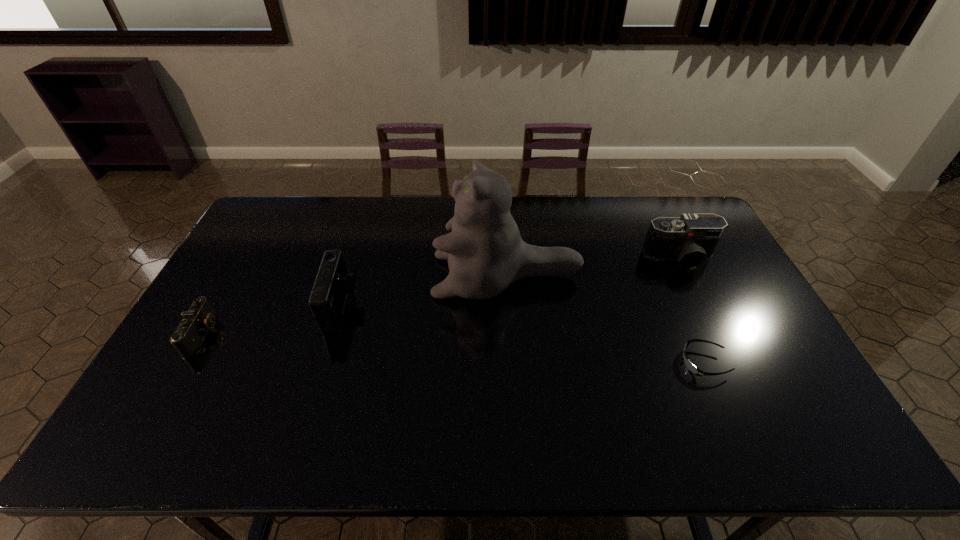
Image resolution: width=960 pixels, height=540 pixels. I want to click on vacant space located on the front-facing side of the fourth object from right to left, so click(472, 307).

The image size is (960, 540). Identify the location of vacant space located on the front-facing side of the rightmost camera. click(x=707, y=313).

Where is `vacant region located on the front-facing side of the leftmost camera`? This screenshot has width=960, height=540. vacant region located on the front-facing side of the leftmost camera is located at coordinates pyautogui.click(x=269, y=334).

Find the location of `free location located on the lenses of the sunglasses`. free location located on the lenses of the sunglasses is located at coordinates (553, 363).

I want to click on blank area located 0.230m on the lenses of the sunglasses, so click(594, 363).

At what (x,y) coordinates should I click in order to perform the action: click on vacant space situated 0.290m on the lenses of the sunglasses. Please return your answer as a coordinate pair (x, y). The width and height of the screenshot is (960, 540). Looking at the image, I should click on (x=572, y=363).

Where is `object at the left edge`? object at the left edge is located at coordinates (200, 317).

I want to click on object positioned at the right edge, so click(691, 239).

Find the location of `vacant region at the far edge of the desktop`. vacant region at the far edge of the desktop is located at coordinates (587, 219).

The image size is (960, 540). I want to click on vacant space at the near edge of the desktop, so click(x=507, y=453).